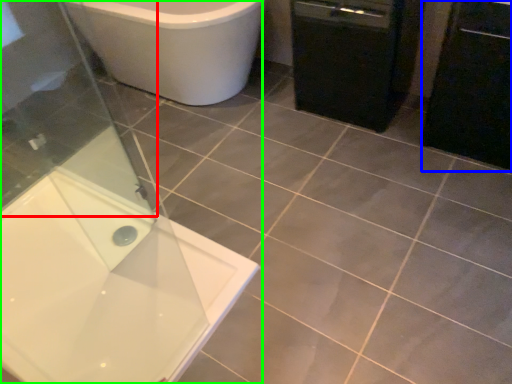
Question: Estimate the real-world distances between objects in this image. Which object is farther from screen door (highlighted by a red box), cabinetry (highlighted by a blue box) or bathtub (highlighted by a green box)?

Choices:
 (A) cabinetry
 (B) bathtub

Answer: (A)